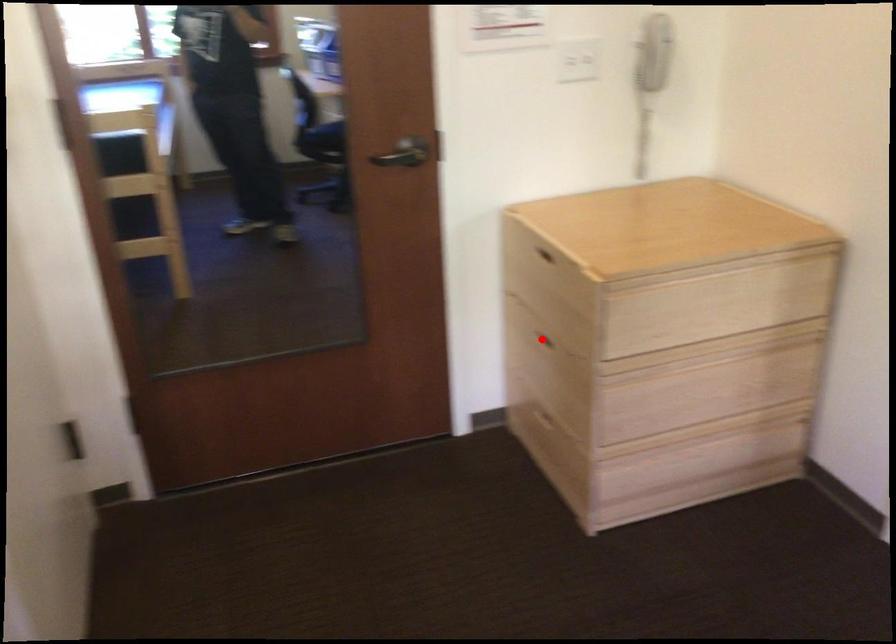
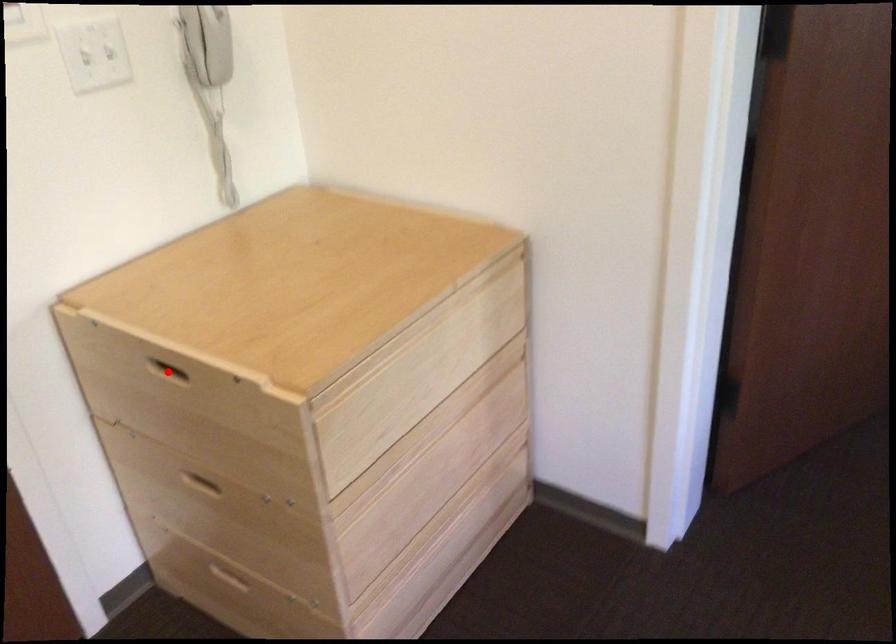
I am providing you with two images of the same scene from different viewpoints. A red point is marked on the first image and another point is marked on the second image. Do the highlighted points in image1 and image2 indicate the same real-world spot?

No